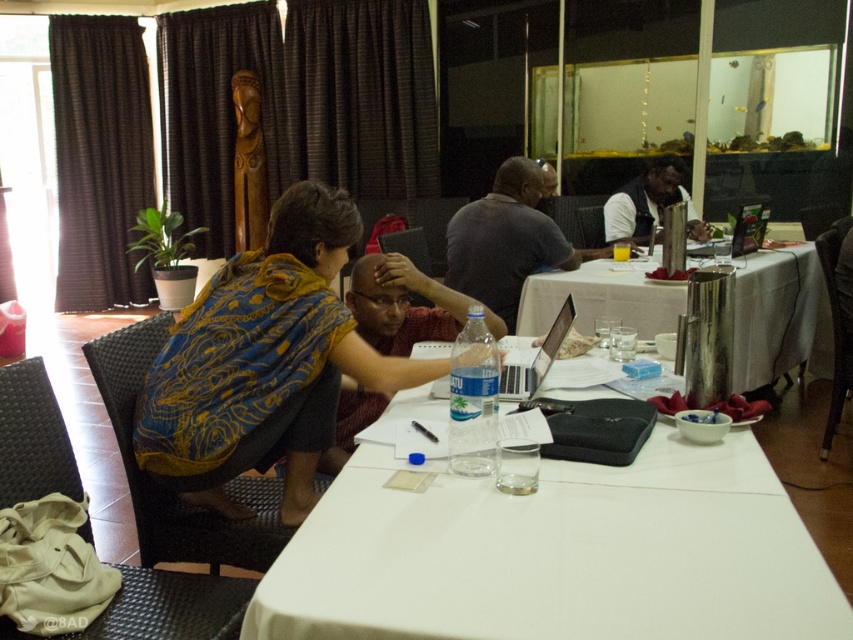
Question: Can you confirm if matte plastic water bottle at center is positioned below matte black laptop at center?

Choices:
 (A) yes
 (B) no

Answer: (A)

Question: Is blue patterned scarf at center behind dark blue shirt at center?

Choices:
 (A) no
 (B) yes

Answer: (A)

Question: Which object appears farthest from the camera in this image?

Choices:
 (A) matte black laptop at upper right
 (B) blue patterned scarf at center
 (C) matte plastic water bottle at center

Answer: (A)

Question: Which of these objects is positioned farthest from the white cloth-covered table at center?

Choices:
 (A) matte plastic water bottle at center
 (B) dark blue shirt at center
 (C) dark gray shirt at center
 (D) matte black laptop at upper right

Answer: (B)

Question: Does dark blue shirt at center appear over matte black laptop at upper right?

Choices:
 (A) yes
 (B) no

Answer: (A)

Question: Which object is closer to the camera taking this photo?

Choices:
 (A) matte plastic water bottle at center
 (B) white cloth at center
 (C) white cloth-covered table at center
 (D) matte black laptop at center

Answer: (C)